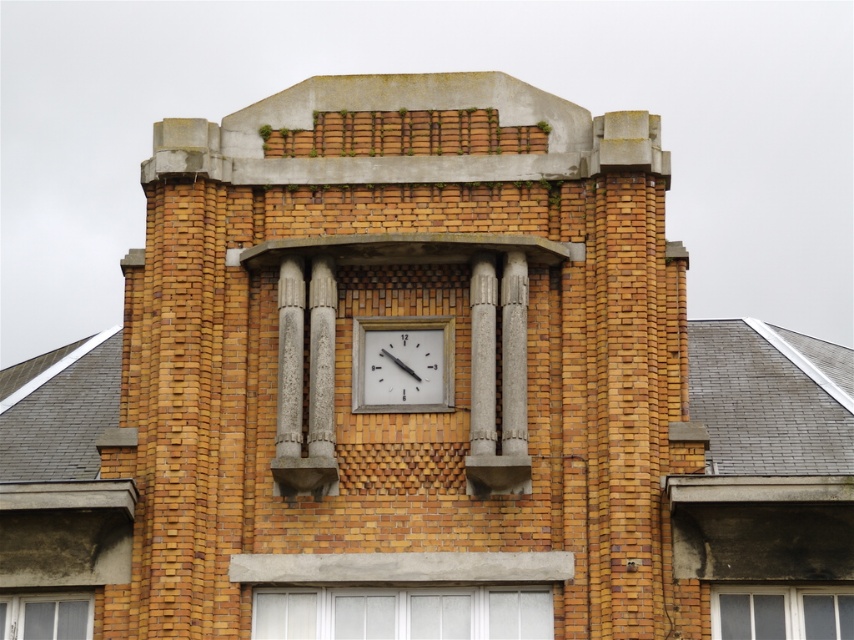
Question: Which point appears closest to the camera in this image?

Choices:
 (A) (367, 404)
 (B) (354, 628)

Answer: (B)

Question: Does white matte clock at center have a smaller size compared to matte glass window at lower right?

Choices:
 (A) yes
 (B) no

Answer: (A)

Question: Which of the following is the farthest from the observer?

Choices:
 (A) (340, 611)
 (B) (651, 272)
 (C) (740, 589)

Answer: (B)

Question: Is white glass window at lower center below white matte clock at center?

Choices:
 (A) yes
 (B) no

Answer: (A)

Question: Which of the following is the closest to the observer?

Choices:
 (A) clear glass window at lower left
 (B) matte glass window at lower right
 (C) white matte clock at center
 (D) brick clock at center

Answer: (D)

Question: Is white glass window at lower center above white matte clock at center?

Choices:
 (A) yes
 (B) no

Answer: (B)